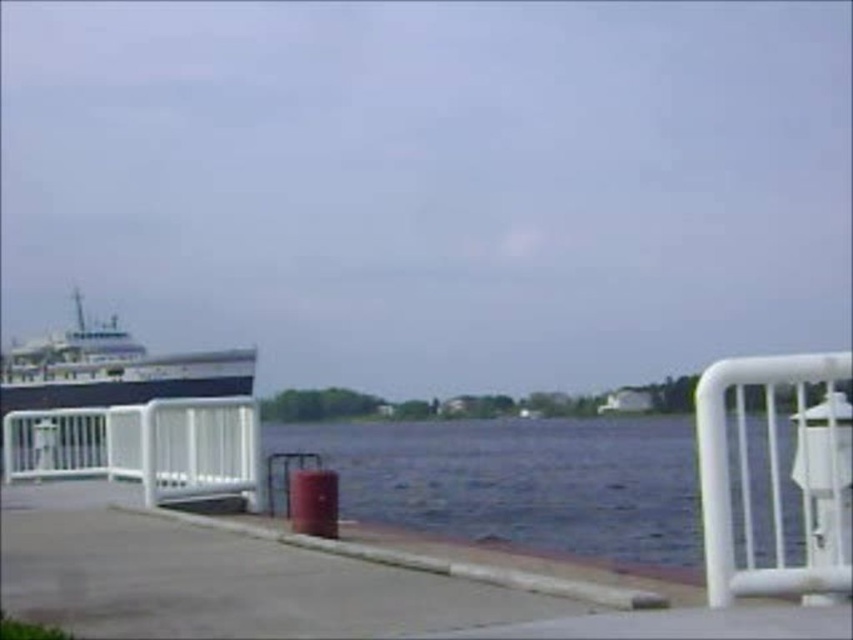
You are standing at the center of the image and want to walk towards the white metal fence at left. In which direction should you move?

The white metal fence at left is located at the left side of the image, so you should move to your left to reach it.